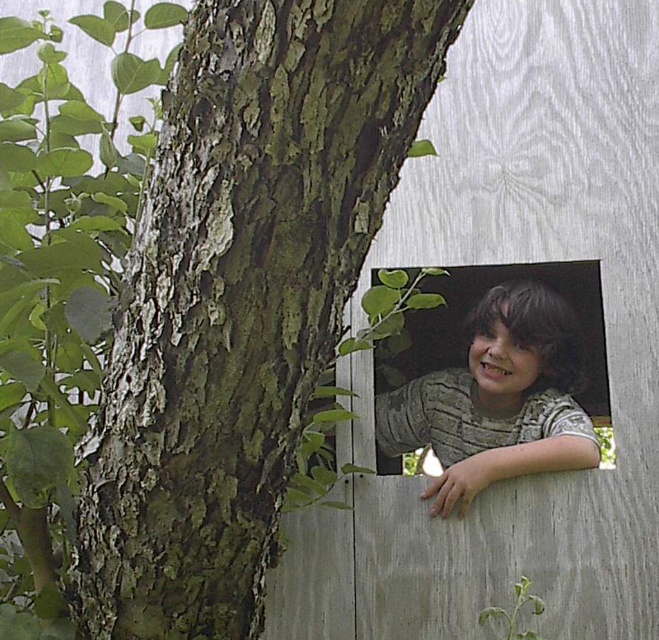
Can you confirm if greenish-brown bark at center is wider than matte gray shirt at center?

Yes.

Which is in front, point (169, 532) or point (569, 464)?

Point (169, 532) is in front.

Describe the element at coordinates (241, 296) in the screenshot. I see `greenish-brown bark at center` at that location.

At what (x,y) coordinates should I click in order to perform the action: click on greenish-brown bark at center. Please return your answer as a coordinate pair (x, y). This screenshot has height=640, width=659. Looking at the image, I should click on (241, 296).